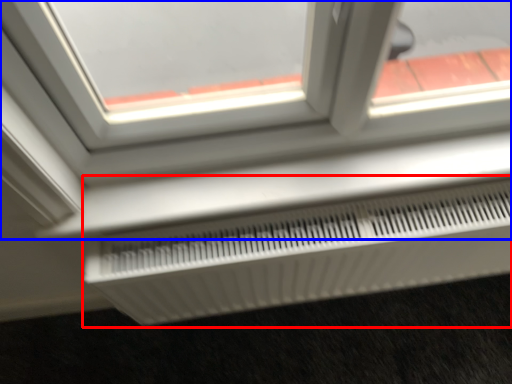
Question: Which of the following is the closest to the observer, air conditioning (highlighted by a red box) or window (highlighted by a blue box)?

Choices:
 (A) air conditioning
 (B) window

Answer: (B)